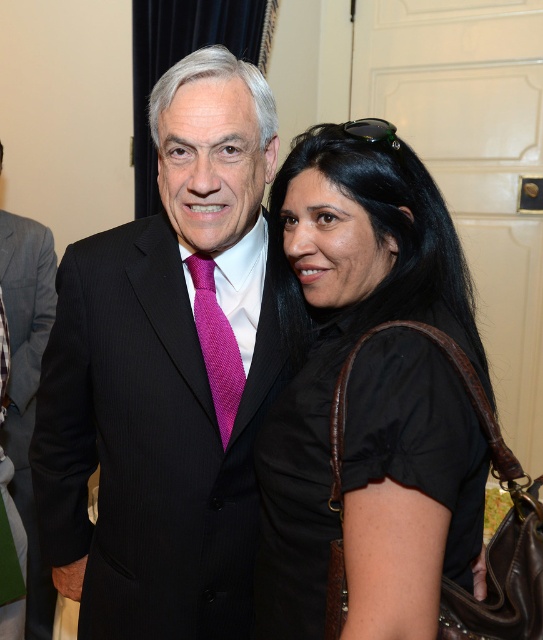
Question: Is black pinstripe suit at center bigger than black leather handbag at center?

Choices:
 (A) yes
 (B) no

Answer: (A)

Question: Among these points, which one is nearest to the camera?

Choices:
 (A) pos(213,292)
 (B) pos(476,342)

Answer: (B)

Question: Which object is farther from the camera taking this photo?

Choices:
 (A) black leather handbag at center
 (B) black pinstripe suit at center
 (C) gray wool suit at left

Answer: (C)

Question: Which point is closer to the camera?

Choices:
 (A) (239, 515)
 (B) (212, 332)
 (C) (47, 616)

Answer: (A)

Question: Is black pinstripe suit at center below gray wool suit at left?

Choices:
 (A) yes
 (B) no

Answer: (B)

Question: Can you confirm if black pinstripe suit at center is positioned to the left of gray wool suit at left?

Choices:
 (A) no
 (B) yes

Answer: (A)